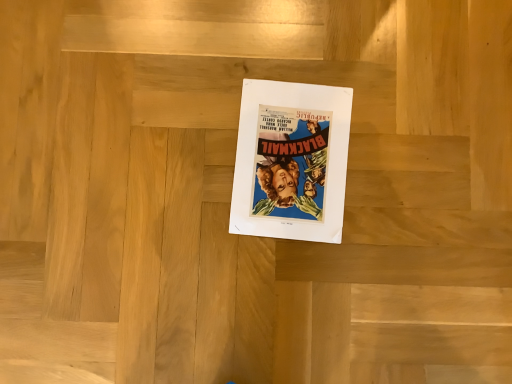
Image resolution: width=512 pixels, height=384 pixels. What are the coordinates of `free point behind matte paper poster at center` in the screenshot? It's located at (321, 48).